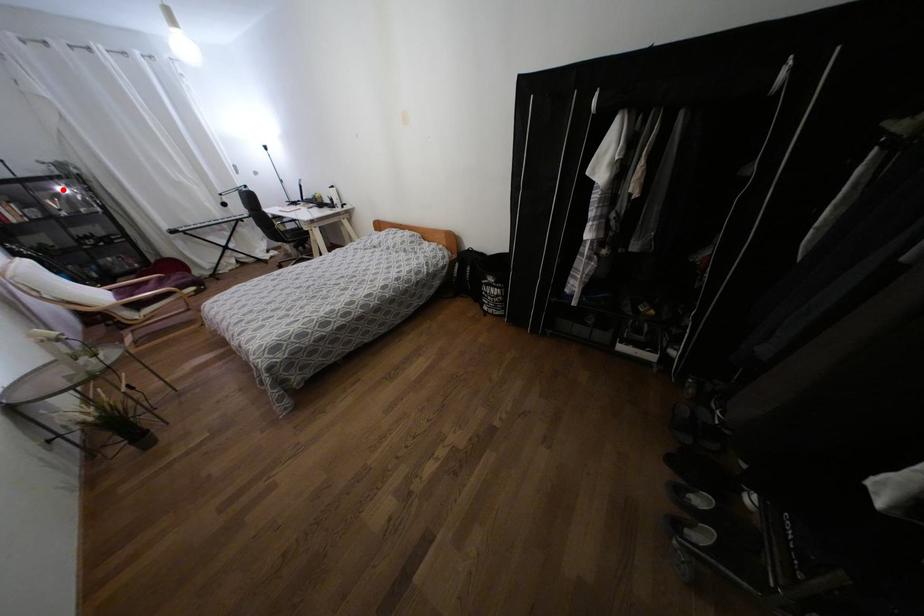
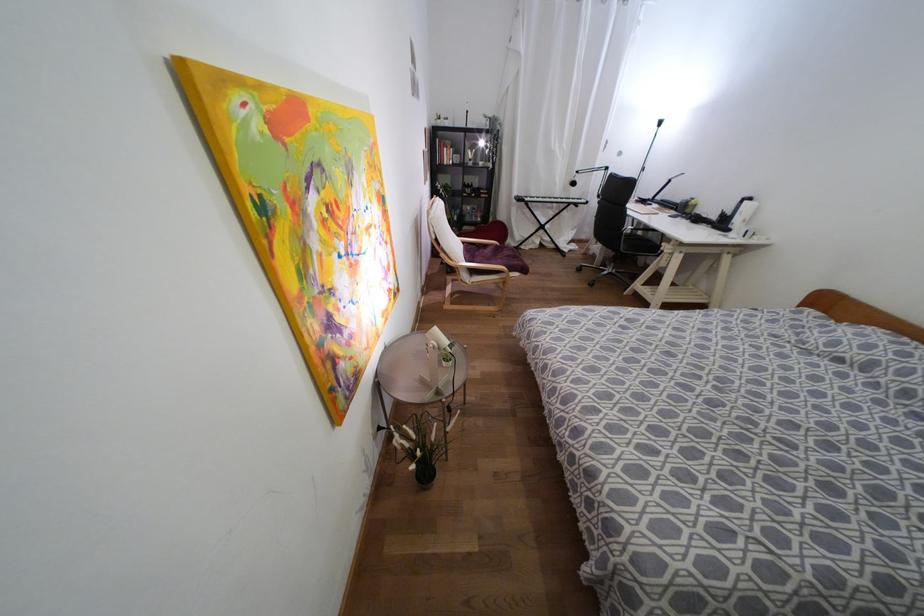
Question: I am providing you with two images of the same scene from different viewpoints. A red point is shown in image1. For the corresponding object point in image2, is it positioned nearer or farther from the camera?

Choices:
 (A) Nearer
 (B) Farther

Answer: (A)